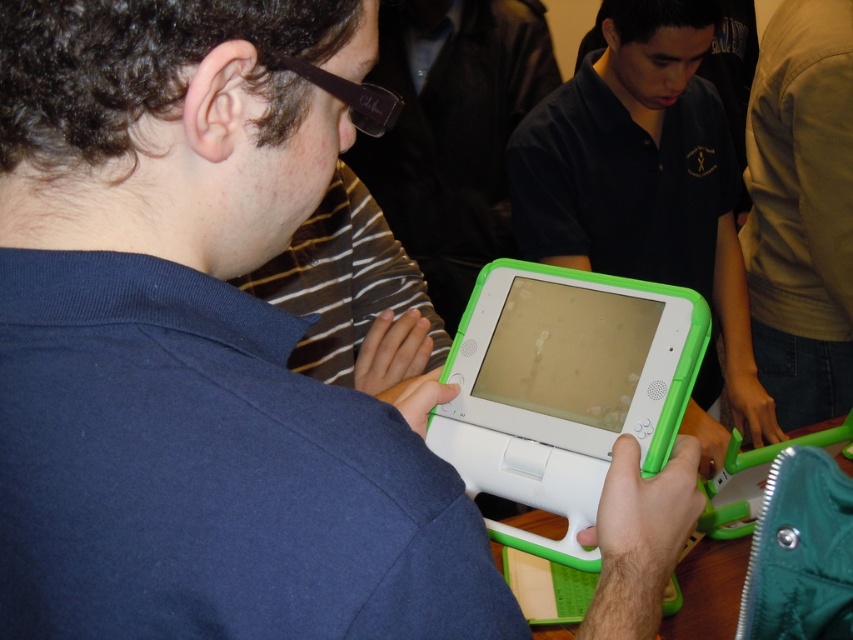
You are a person with a height of 1.7 meters standing in front of the matte green tablet at center. If you want to reach the tablet without moving your feet, what is the maximum height you can comfortably reach?

The matte green tablet at center is 1.26 meters away from the camera. Since the person is 1.7 meters tall, they can comfortably reach up to approximately 2.1 meters. The tablet is within this range, so they can reach it without moving their feet.

You are part of a group working on a project that requires using a tablet. The project requires a larger screen to display more information. Which tablet should you choose between the matte green tablet at center and the white plastic tablet at center?

The matte green tablet at center is bigger than the white plastic tablet at center, so you should choose the matte green tablet at center for the project to display more information.

You are part of a team working on a project and need to access the matte green tablet at center and the white plastic tablet at center. Based on their positions, which tablet should you reach for first without moving your current position?

The matte green tablet at center is located above the white plastic tablet at center, so you should reach for the matte green tablet at center first as it is closer to your line of sight.